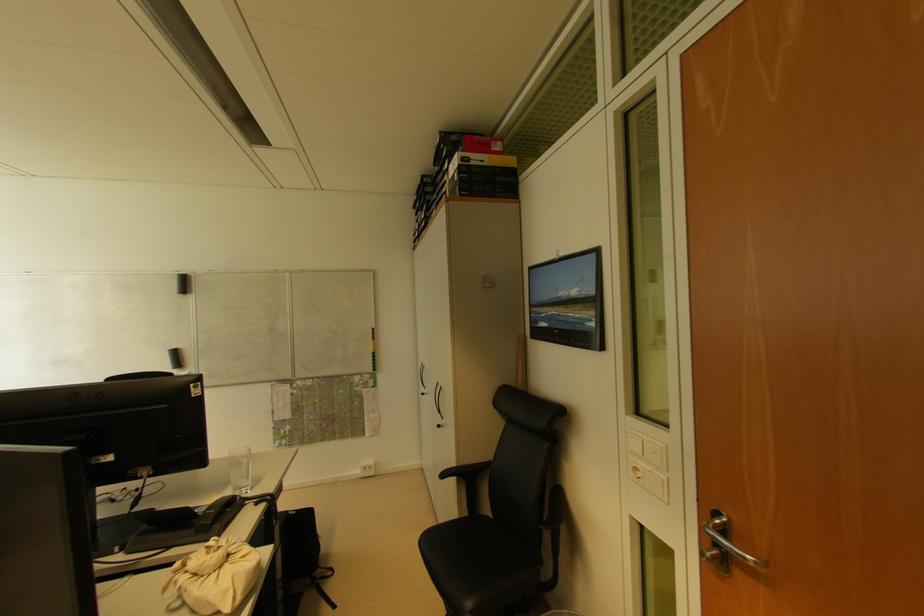
Find where to pull the silver cabinet handle. Please return your answer as a coordinate pair (x, y).

(438, 399)